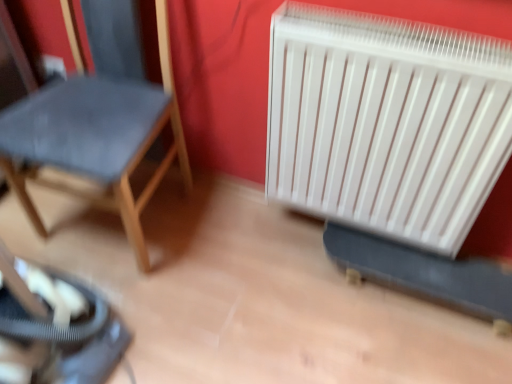
Question: From the image's perspective, is velvet blue chair at left below white plastic radiator at right?

Choices:
 (A) yes
 (B) no

Answer: (B)

Question: Is velvet blue chair at left oriented towards white plastic radiator at right?

Choices:
 (A) yes
 (B) no

Answer: (B)

Question: Is velvet blue chair at left turned away from white plastic radiator at right?

Choices:
 (A) yes
 (B) no

Answer: (B)

Question: Considering the relative sizes of velvet blue chair at left and white plastic radiator at right in the image provided, is velvet blue chair at left smaller than white plastic radiator at right?

Choices:
 (A) no
 (B) yes

Answer: (A)

Question: Is velvet blue chair at left not near white plastic radiator at right?

Choices:
 (A) no
 (B) yes

Answer: (A)

Question: Does velvet blue chair at left have a lesser height compared to white plastic radiator at right?

Choices:
 (A) yes
 (B) no

Answer: (B)

Question: From the image's perspective, is white plastic radiator at right above velvet blue chair at left?

Choices:
 (A) no
 (B) yes

Answer: (A)

Question: Considering the relative sizes of white plastic radiator at right and velvet blue chair at left in the image provided, is white plastic radiator at right bigger than velvet blue chair at left?

Choices:
 (A) yes
 (B) no

Answer: (B)

Question: Is white plastic radiator at right with velvet blue chair at left?

Choices:
 (A) no
 (B) yes

Answer: (A)

Question: Does white plastic radiator at right contain velvet blue chair at left?

Choices:
 (A) no
 (B) yes

Answer: (A)

Question: Is white plastic radiator at right at the right side of velvet blue chair at left?

Choices:
 (A) no
 (B) yes

Answer: (B)

Question: Is white plastic radiator at right further to the viewer compared to velvet blue chair at left?

Choices:
 (A) yes
 (B) no

Answer: (A)

Question: Is white plastic radiator at right bigger or smaller than velvet blue chair at left?

Choices:
 (A) big
 (B) small

Answer: (B)